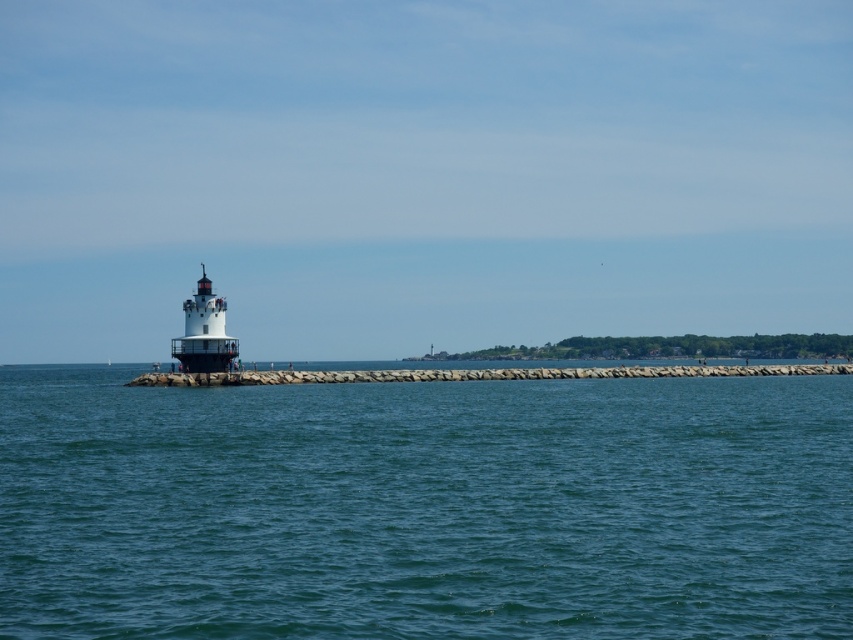
Question: Which object is farther from the camera taking this photo?

Choices:
 (A) blue water at center
 (B) white painted metal lighthouse at left
 (C) smooth concrete wall at center

Answer: (B)

Question: Is smooth concrete wall at center thinner than white painted metal lighthouse at left?

Choices:
 (A) yes
 (B) no

Answer: (B)

Question: Is blue water at center smaller than smooth concrete wall at center?

Choices:
 (A) yes
 (B) no

Answer: (A)

Question: Can you confirm if blue water at center is smaller than smooth concrete wall at center?

Choices:
 (A) no
 (B) yes

Answer: (B)

Question: Which point is farther to the camera?

Choices:
 (A) smooth concrete wall at center
 (B) white painted metal lighthouse at left
 (C) blue water at center

Answer: (B)

Question: Which of the following is the closest to the observer?

Choices:
 (A) (825, 480)
 (B) (195, 365)
 (C) (251, 372)

Answer: (A)